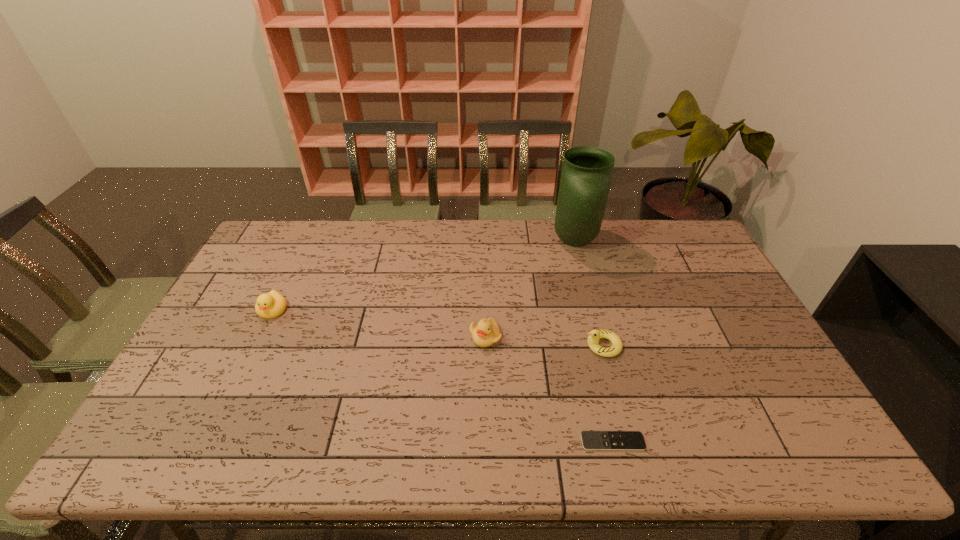
This screenshot has height=540, width=960. Find the location of `vacant region at the left edge of the desktop`. vacant region at the left edge of the desktop is located at coordinates (236, 289).

Locate an element on the screen. free location at the right edge is located at coordinates (718, 278).

In the image, there is a desktop. Where is `free space at the far left corner`? The width and height of the screenshot is (960, 540). free space at the far left corner is located at coordinates (285, 230).

The width and height of the screenshot is (960, 540). In the image, there is a desktop. In order to click on vacant space at the near left corner in this screenshot , I will do `click(210, 434)`.

Locate an element on the screen. The image size is (960, 540). vacant space at the far right corner of the desktop is located at coordinates (665, 238).

Locate an element on the screen. Image resolution: width=960 pixels, height=540 pixels. vacant area at the near right corner is located at coordinates (766, 430).

Image resolution: width=960 pixels, height=540 pixels. Find the location of `vacant space that's between the remote control and the farthest duckling`. vacant space that's between the remote control and the farthest duckling is located at coordinates (443, 376).

Image resolution: width=960 pixels, height=540 pixels. Find the location of `vacant point located between the fourth object from right to left and the farthest duckling`. vacant point located between the fourth object from right to left and the farthest duckling is located at coordinates (379, 323).

Image resolution: width=960 pixels, height=540 pixels. What are the coordinates of `free space between the second object from left to right and the leftmost object` in the screenshot? It's located at (379, 323).

At what (x,y) coordinates should I click in order to perform the action: click on free area in between the fourth object from right to left and the farthest duckling. Please return your answer as a coordinate pair (x, y). This screenshot has height=540, width=960. Looking at the image, I should click on (379, 323).